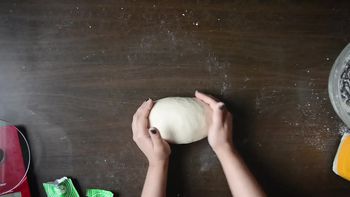
I want to click on table, so click(270, 58).